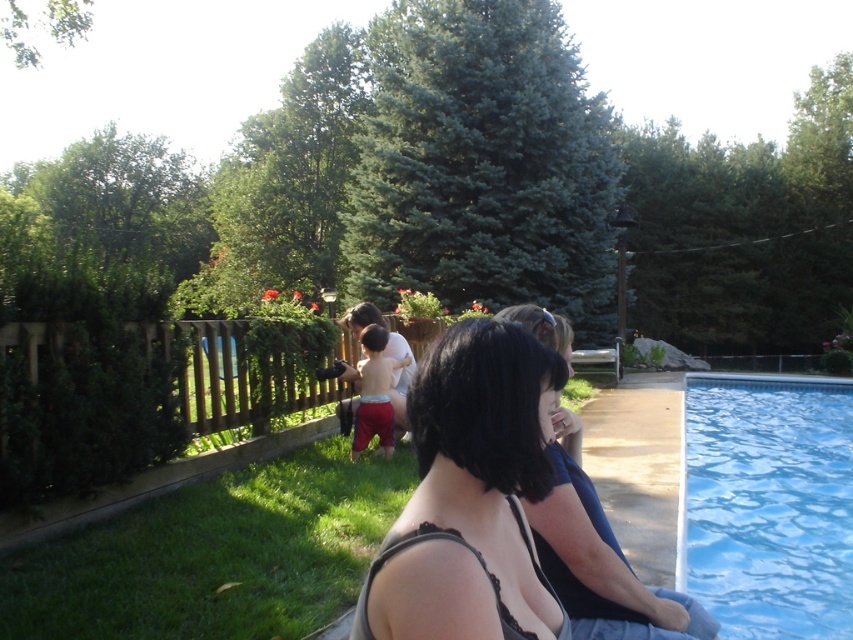
You are a drone operator trying to capture a photo of the dark gray fabric top at lower right and the blue smooth water at right. Your drone has a camera with a 5 meter range. Can you take a photo of both objects at the same time without moving the drone?

The distance between the blue smooth water at right and the dark gray fabric top at lower right is 9.34 meters. Since the drone camera has a 5 meter range, it cannot capture both objects in the same shot without moving the drone.